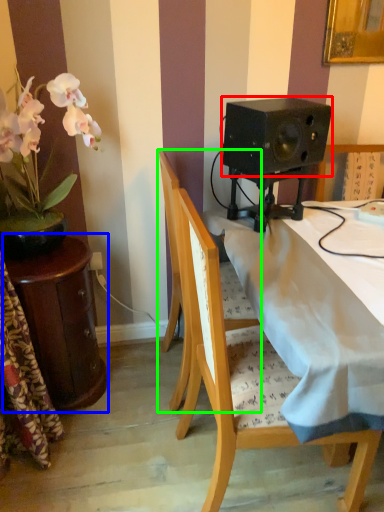
Question: Which is farther away from speaker (highlighted by a red box)? table (highlighted by a blue box) or chair (highlighted by a green box)?

Choices:
 (A) table
 (B) chair

Answer: (A)